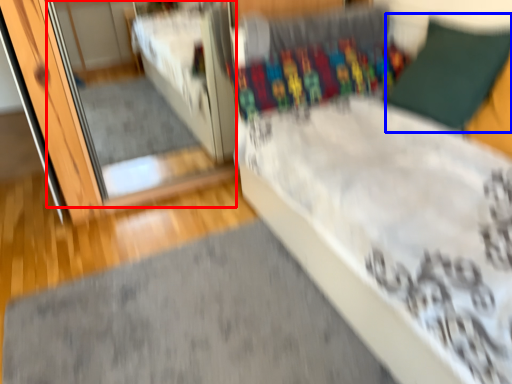
Question: Which of the following is the closest to the observer, mirror (highlighted by a red box) or pillow (highlighted by a blue box)?

Choices:
 (A) mirror
 (B) pillow

Answer: (B)